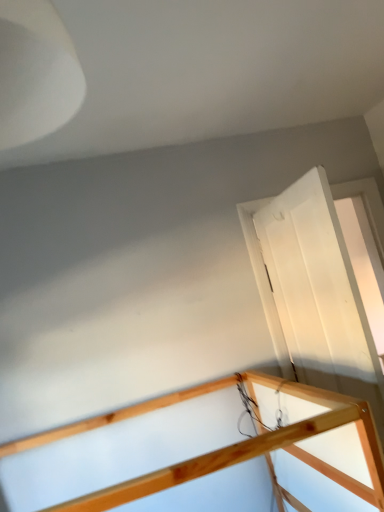
Question: Considering the relative positions of white glossy door at right and natural wood rail at upper right in the image provided, is white glossy door at right behind natural wood rail at upper right?

Choices:
 (A) no
 (B) yes

Answer: (B)

Question: From a real-world perspective, does white glossy door at right sit lower than natural wood rail at upper right?

Choices:
 (A) no
 (B) yes

Answer: (A)

Question: Does white glossy door at right have a greater width compared to natural wood rail at upper right?

Choices:
 (A) yes
 (B) no

Answer: (B)

Question: Would you say white glossy door at right contains natural wood rail at upper right?

Choices:
 (A) no
 (B) yes

Answer: (A)

Question: Can you confirm if white glossy door at right is thinner than natural wood rail at upper right?

Choices:
 (A) no
 (B) yes

Answer: (B)

Question: From a real-world perspective, is white glossy door at right on natural wood rail at upper right?

Choices:
 (A) no
 (B) yes

Answer: (B)

Question: Can you confirm if natural wood rail at upper right is positioned to the right of white glossy door at right?

Choices:
 (A) yes
 (B) no

Answer: (B)

Question: Would you consider natural wood rail at upper right to be distant from white glossy door at right?

Choices:
 (A) no
 (B) yes

Answer: (A)

Question: Is natural wood rail at upper right outside white glossy door at right?

Choices:
 (A) yes
 (B) no

Answer: (A)

Question: Is white glossy door at right at the back of natural wood rail at upper right?

Choices:
 (A) no
 (B) yes

Answer: (A)

Question: From the image's perspective, does natural wood rail at upper right appear higher than white glossy door at right?

Choices:
 (A) no
 (B) yes

Answer: (A)

Question: Does natural wood rail at upper right have a lesser height compared to white glossy door at right?

Choices:
 (A) yes
 (B) no

Answer: (A)

Question: From a real-world perspective, relative to white glossy door at right, is natural wood rail at upper right vertically above or below?

Choices:
 (A) below
 (B) above

Answer: (A)